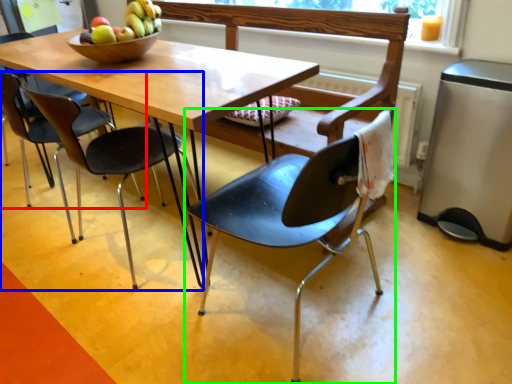
Question: Which is nearer to the chair (highlighted by a red box)? chair (highlighted by a blue box) or chair (highlighted by a green box).

Choices:
 (A) chair
 (B) chair

Answer: (A)